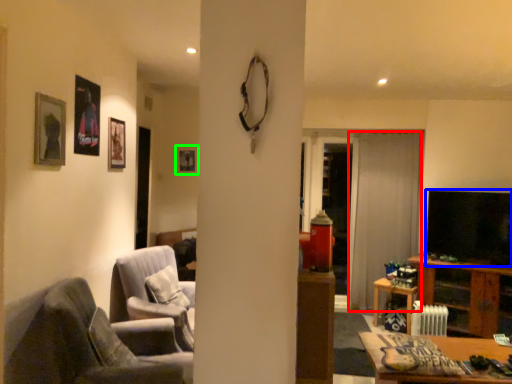
Question: Which is farther away from curtain (highlighted by a red box)? television (highlighted by a blue box) or picture frame (highlighted by a green box)?

Choices:
 (A) television
 (B) picture frame

Answer: (B)